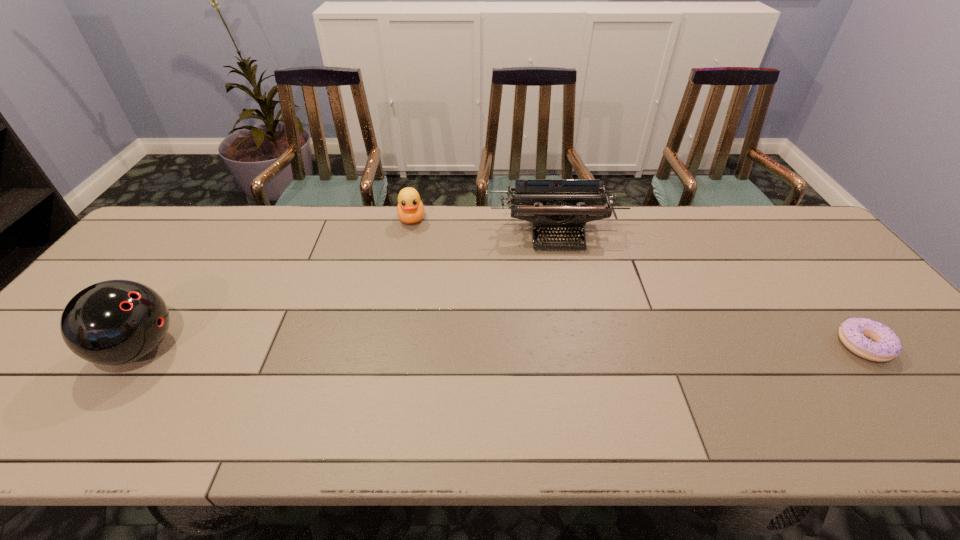
Locate an element on the screen. The image size is (960, 540). free point located on the face of the second shortest object is located at coordinates (414, 276).

At what (x,y) coordinates should I click in order to perform the action: click on free space located on the face of the second shortest object. Please return your answer as a coordinate pair (x, y). The image size is (960, 540). Looking at the image, I should click on (413, 262).

The image size is (960, 540). Identify the location of vacant space located 0.050m on the face of the second shortest object. [412, 239].

Locate an element on the screen. free space located 0.240m on the typing side of the typewriter is located at coordinates (568, 312).

This screenshot has height=540, width=960. What are the coordinates of `free space located on the typing side of the typewriter` in the screenshot? It's located at (563, 273).

Locate an element on the screen. free region located on the typing side of the typewriter is located at coordinates coord(577,363).

Where is `duckling present at the far edge`? This screenshot has width=960, height=540. duckling present at the far edge is located at coordinates (410, 209).

Find the location of a particular element. This screenshot has width=960, height=540. typewriter situated at the far edge is located at coordinates (551, 204).

The width and height of the screenshot is (960, 540). What are the coordinates of `object that is at the near edge` in the screenshot? It's located at (114, 322).

Where is `object at the left edge`? The image size is (960, 540). object at the left edge is located at coordinates (114, 322).